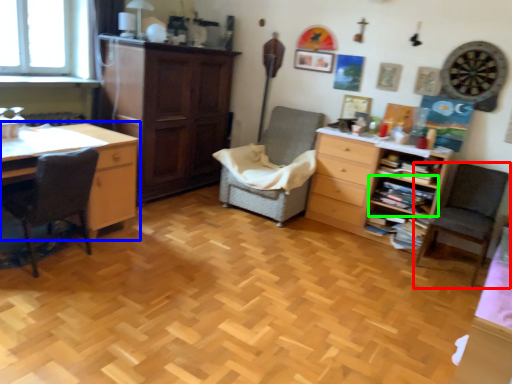
Question: Which is farther away from chair (highlighted by a red box)? desk (highlighted by a blue box) or shelf (highlighted by a green box)?

Choices:
 (A) desk
 (B) shelf

Answer: (A)